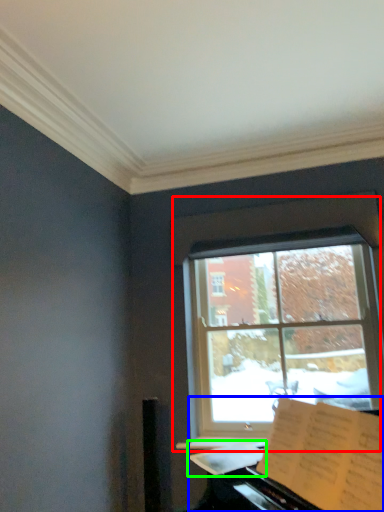
Question: Which is farther away from window (highlighted by a red box)? piano (highlighted by a blue box) or sheet music (highlighted by a green box)?

Choices:
 (A) piano
 (B) sheet music

Answer: (A)